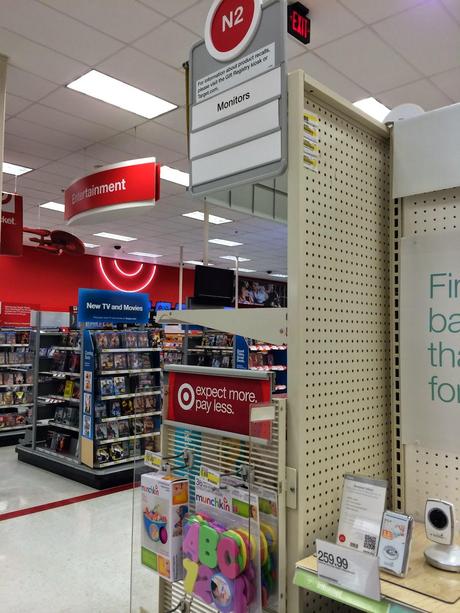
The height and width of the screenshot is (613, 460). Find the location of `webcam`. webcam is located at coordinates (441, 524).